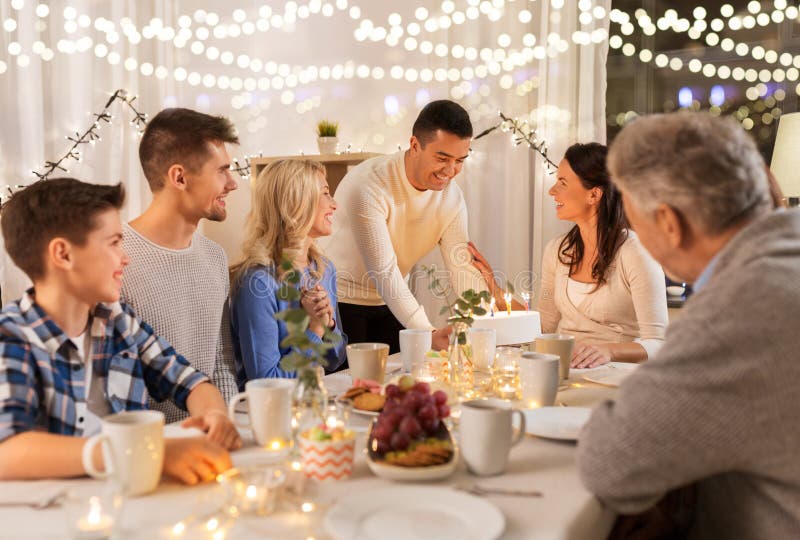
Find the location of a particular element. candles is located at coordinates (530, 293), (509, 294), (494, 300), (485, 300).